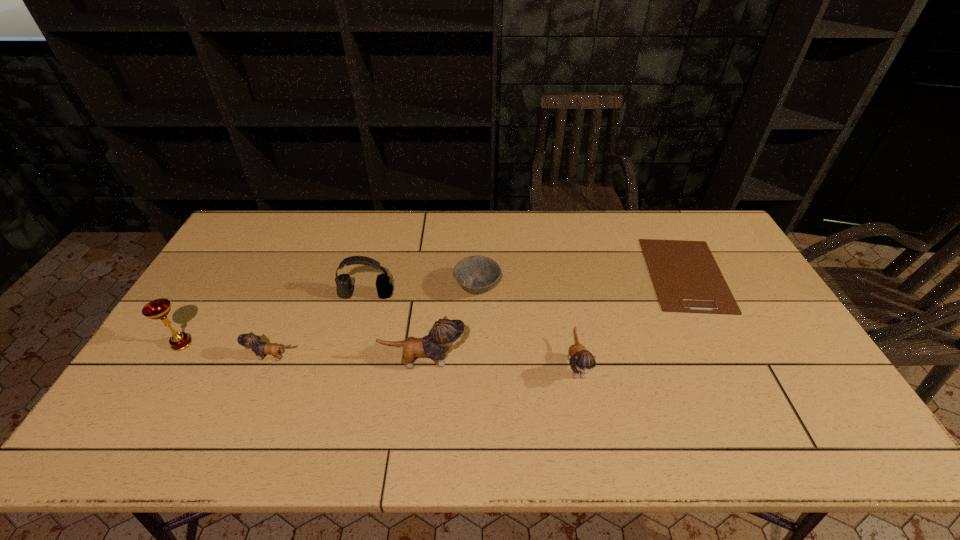
Where is `vacant space that satisfies the following two spatial constraints: 1. on the front side of the shortest object; 2. on the front-facing side of the tallest kitten`? vacant space that satisfies the following two spatial constraints: 1. on the front side of the shortest object; 2. on the front-facing side of the tallest kitten is located at coordinates (730, 361).

Locate an element on the screen. free space that satisfies the following two spatial constraints: 1. on the headband of the fifth object from right to left; 2. on the front-facing side of the leftmost kitten is located at coordinates (349, 357).